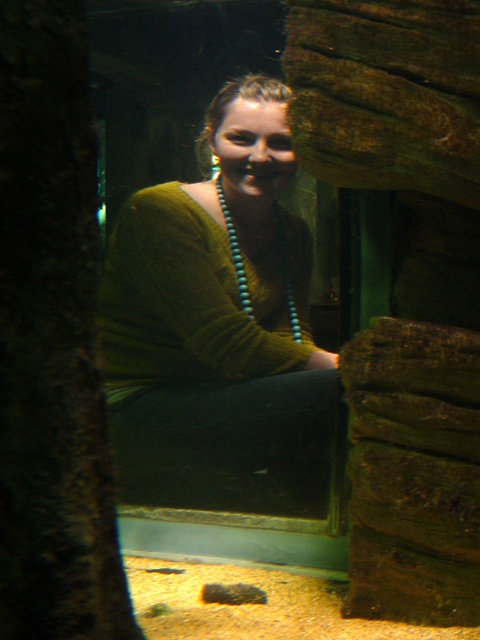
Question: From the image, what is the correct spatial relationship of green matte sweater at center in relation to turquoise beads at center?

Choices:
 (A) above
 (B) below

Answer: (B)

Question: Is the position of green matte sweater at center more distant than that of turquoise beads at center?

Choices:
 (A) yes
 (B) no

Answer: (B)

Question: Which point is farther to the camera?

Choices:
 (A) turquoise beads at center
 (B) green matte sweater at center

Answer: (A)

Question: Does green matte sweater at center have a greater width compared to turquoise beads at center?

Choices:
 (A) no
 (B) yes

Answer: (B)